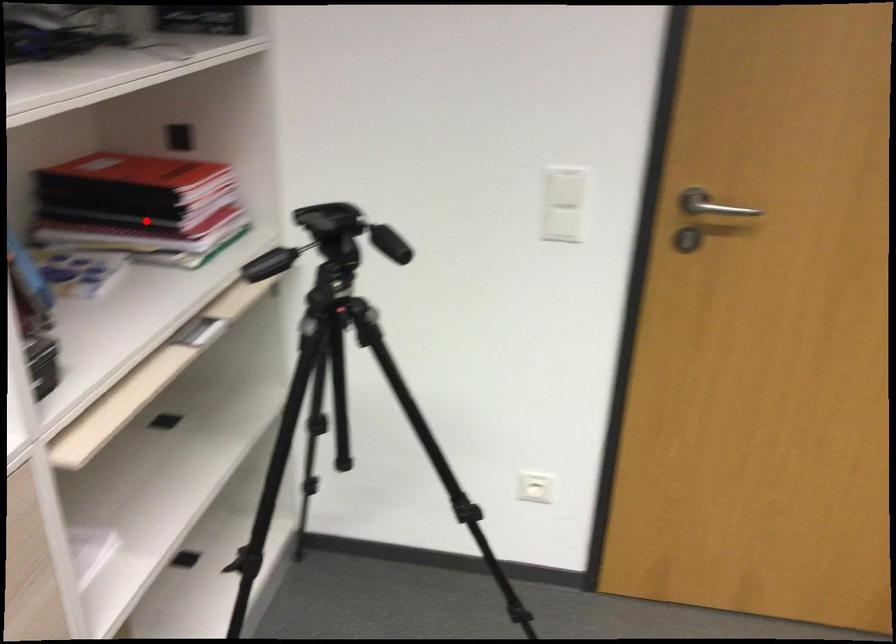
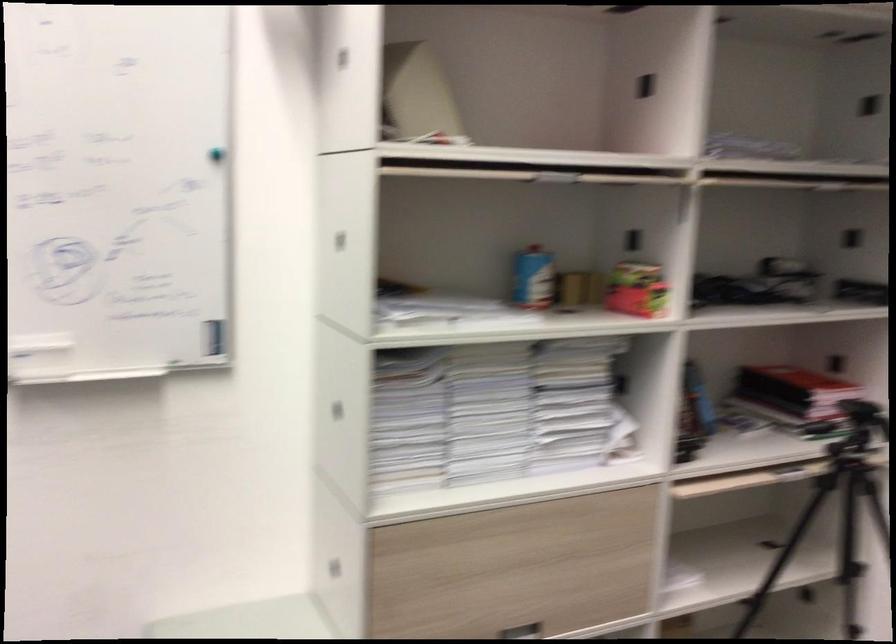
The point at the highlighted location is marked in the first image. Where is the corresponding point in the second image?

(793, 398)